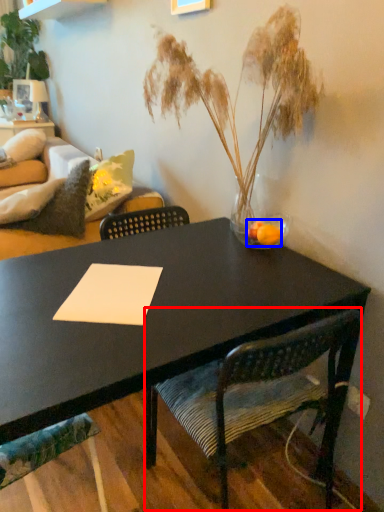
Question: Among these objects, which one is nearest to the camera, chair (highlighted by a red box) or flower (highlighted by a blue box)?

Choices:
 (A) chair
 (B) flower

Answer: (A)